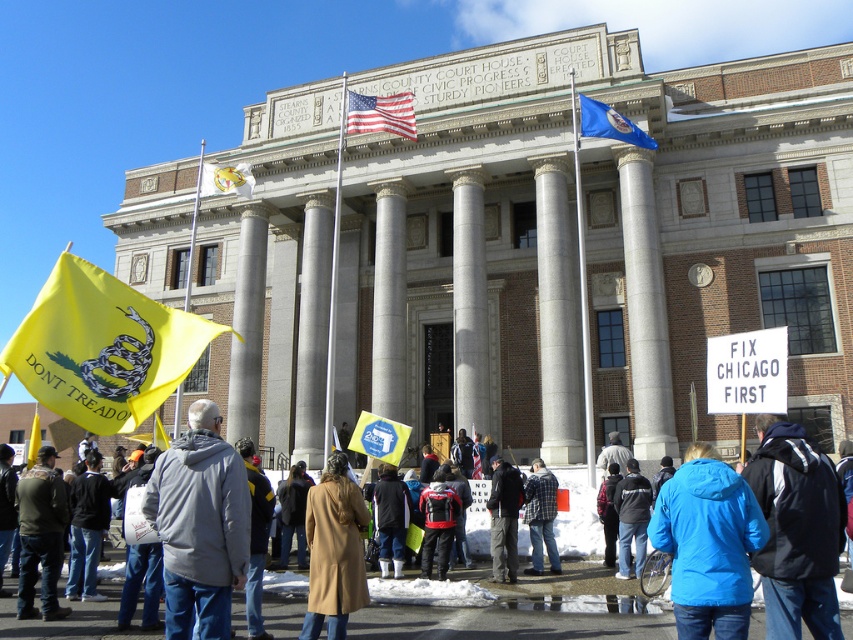
Which is more to the left, blue fabric jacket at lower center or dark gray jacket at lower left?

From the viewer's perspective, dark gray jacket at lower left appears more on the left side.

From the picture: Between blue fabric jacket at lower center and dark gray jacket at lower left, which one appears on the right side from the viewer's perspective?

blue fabric jacket at lower center

Locate an element on the screen. This screenshot has width=853, height=640. blue fabric jacket at lower center is located at coordinates (708, 544).

This screenshot has height=640, width=853. I want to click on blue fabric jacket at lower center, so click(x=708, y=544).

Between blue fabric jacket at center and white fabric flag at center, which one has less height?

blue fabric jacket at center

Is point (403, 612) positioned behind point (202, 180)?

No, (403, 612) is closer to viewer.

Describe the element at coordinates (503, 612) in the screenshot. I see `blue fabric jacket at center` at that location.

At what (x,y) coordinates should I click in order to perform the action: click on blue fabric jacket at center. Please return your answer as a coordinate pair (x, y). This screenshot has height=640, width=853. Looking at the image, I should click on (503, 612).

Is point (440, 595) behind point (531, 524)?

No, (440, 595) is in front of (531, 524).

Measure the distance from blue fabric jacket at center to flannel shirt at center.

blue fabric jacket at center is 13.57 meters away from flannel shirt at center.

The width and height of the screenshot is (853, 640). What are the coordinates of `blue fabric jacket at center` in the screenshot? It's located at (503, 612).